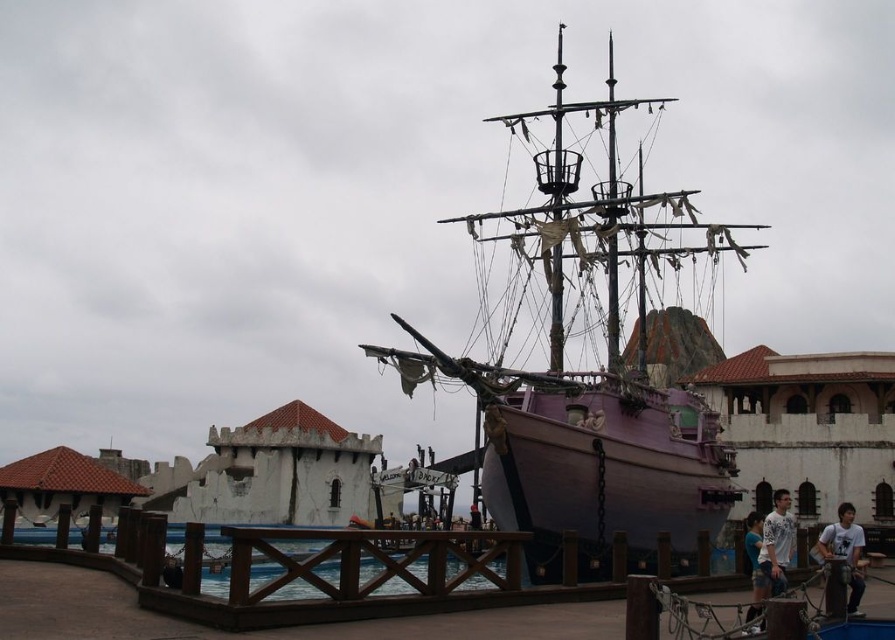
Question: Which point appears farthest from the camera in this image?

Choices:
 (A) (73, 548)
 (B) (845, 538)

Answer: (A)

Question: Where is purple matte ship at center located in relation to light brown wood shirt at lower right in the image?

Choices:
 (A) above
 (B) below

Answer: (A)

Question: Which point is closer to the camera taking this photo?

Choices:
 (A) (644, 545)
 (B) (167, 595)
 (C) (824, 550)
 (D) (760, 563)

Answer: (B)

Question: Can you confirm if white cotton shirt at lower right is thinner than light brown wood shirt at lower right?

Choices:
 (A) yes
 (B) no

Answer: (B)

Question: Which object appears closest to the camera in this image?

Choices:
 (A) light brown wood shirt at lower right
 (B) white cotton shirt at lower right
 (C) purple matte ship at center
 (D) brown wooden dock at center

Answer: (D)

Question: Can you confirm if purple matte ship at center is wider than white cotton shirt at lower right?

Choices:
 (A) yes
 (B) no

Answer: (A)